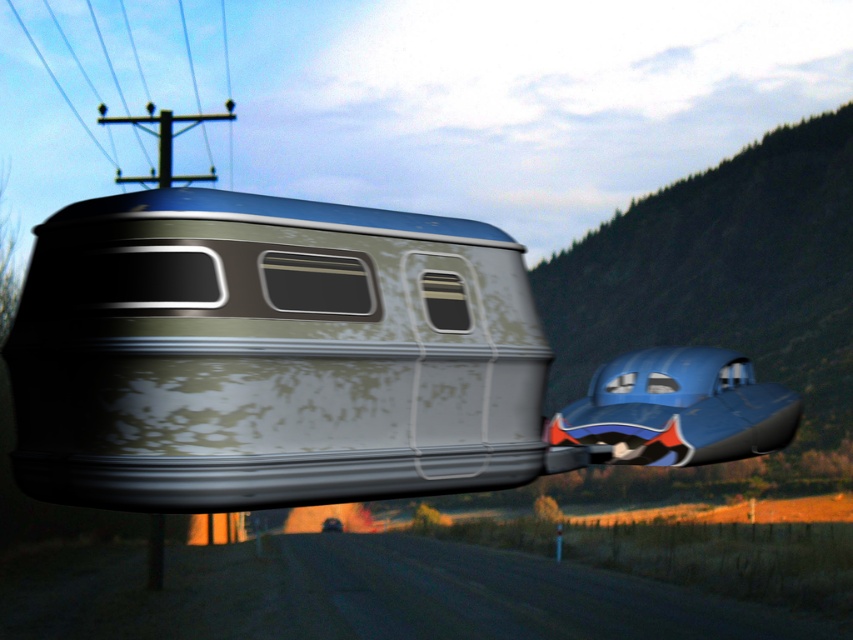
You are a traveler who wants to board the closest vehicle to you. You are standing at the center of the road. Which vehicle should you choose between the rusty metal train car at center and the blue rubber car at center right?

The rusty metal train car at center is located at the center of the road, while the blue rubber car at center right is positioned to the right of the center. Since you are standing at the center, the rusty metal train car at center is closer to you than the blue rubber car at center right. Therefore, you should choose the rusty metal train car at center.

You are standing at the camera position looking at the two points in the image. Which point, point (527, 426) or point (146, 177), is nearer to you?

Point (527, 426) is closer to the camera than point (146, 177).

You are a delivery drone that needs to fly between the rusty metal train car at center and the blue rubber car at center right. Can you pass through the gap between them without hitting either?

The rusty metal train car at center is much taller than the blue rubber car at center right, so the gap between them might be too narrow for the drone to pass safely. Check the vertical clearance before attempting to fly through.